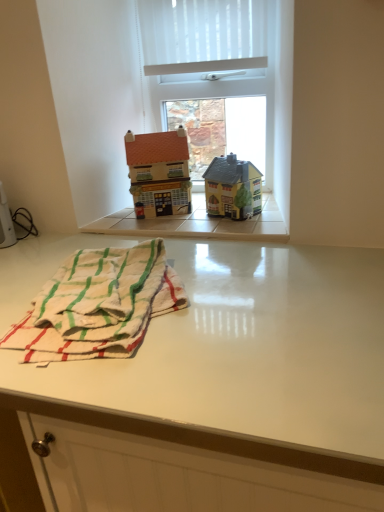
Identify the location of vacant space in front of yellow matte house at center, which is counted as the second toy, starting from the left. (239, 227).